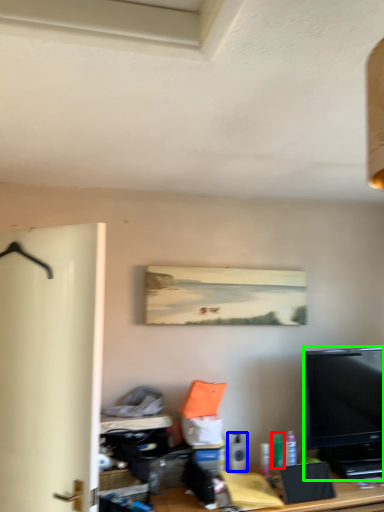
Question: Which is nearer to the toiletry (highlighted by a red box)? toiletry (highlighted by a blue box) or television (highlighted by a green box).

Choices:
 (A) toiletry
 (B) television

Answer: (A)